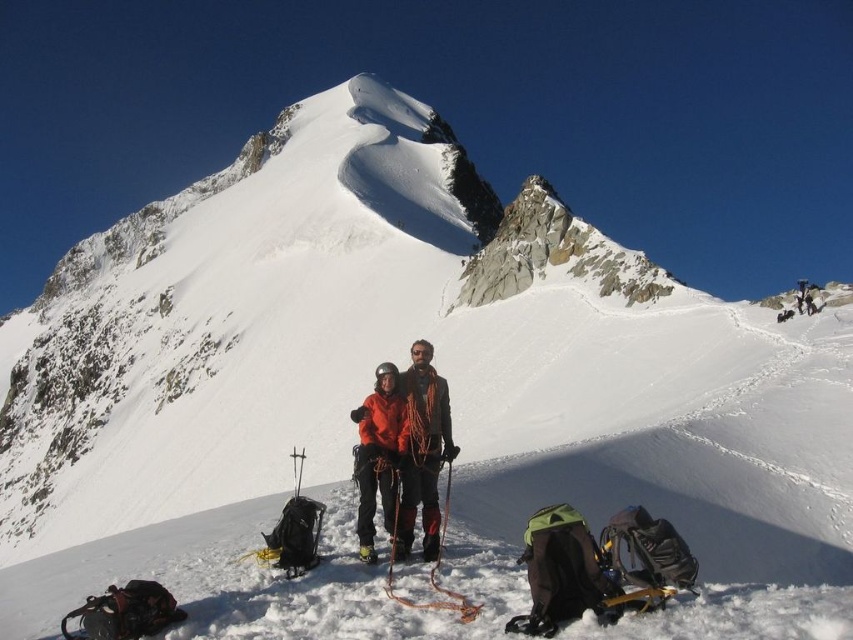
You are a photographer trying to capture both the orange fabric jacket at center and the orange softshell jacket at center in a single frame. Based on their positions, which jacket should you adjust your camera to focus on first to ensure both are in the frame?

You should focus on the orange softshell jacket at center first because the orange fabric jacket at center is to the right of it, so adjusting the frame to include both would require accounting for their horizontal positioning.

You are a photographer trying to capture both the orange fabric jacket at center and the orange softshell jacket at center in a single shot. Which jacket would appear taller in your photo?

The orange fabric jacket at center would appear taller in the photo as it has a greater height compared to the orange softshell jacket at center.

You are planning to place a safety marker between the two points, point (418, 477) and point (398, 436). Which point should the marker be closer to in order to be nearer to the climbers on the slope?

The safety marker should be placed closer to point (418, 477) because it is closer to the viewer than point (398, 436), making it nearer to the climbers on the slope.